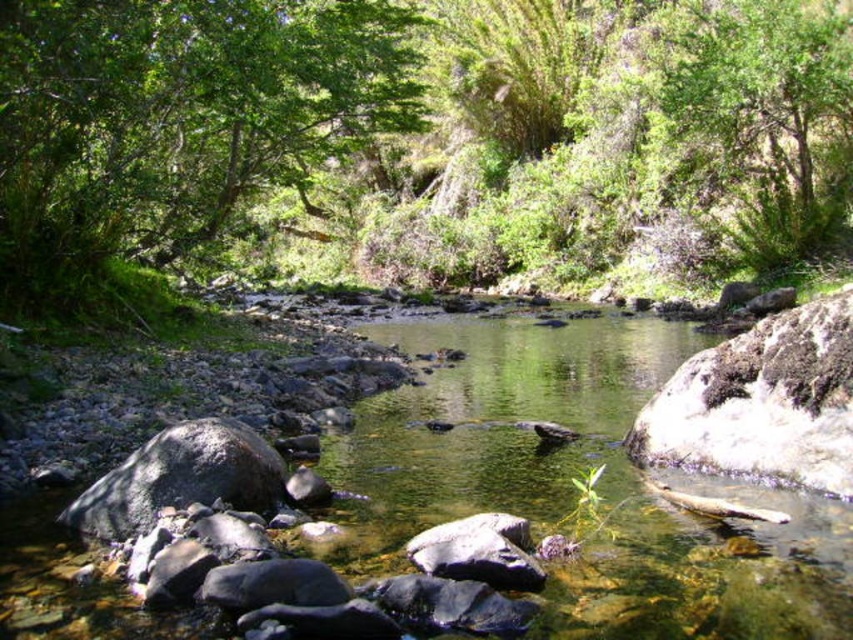
Question: Based on their relative distances, which object is nearer to the green leafy tree at upper left?

Choices:
 (A) green leafy tree at upper right
 (B) clear water at center
 (C) green leafy forest at center

Answer: (C)

Question: Considering the relative positions of green leafy forest at center and green leafy tree at upper left in the image provided, where is green leafy forest at center located with respect to green leafy tree at upper left?

Choices:
 (A) below
 (B) above

Answer: (B)

Question: Estimate the real-world distances between objects in this image. Which object is farther from the clear water at center?

Choices:
 (A) green leafy tree at upper left
 (B) green leafy forest at center
 (C) green leafy tree at upper right

Answer: (B)

Question: Can you confirm if green leafy tree at upper left is positioned above green leafy tree at upper right?

Choices:
 (A) yes
 (B) no

Answer: (B)

Question: Which object is positioned farthest from the green leafy tree at upper left?

Choices:
 (A) clear water at center
 (B) green leafy tree at upper right
 (C) green leafy forest at center

Answer: (B)

Question: Does green leafy forest at center appear under green leafy tree at upper left?

Choices:
 (A) yes
 (B) no

Answer: (B)